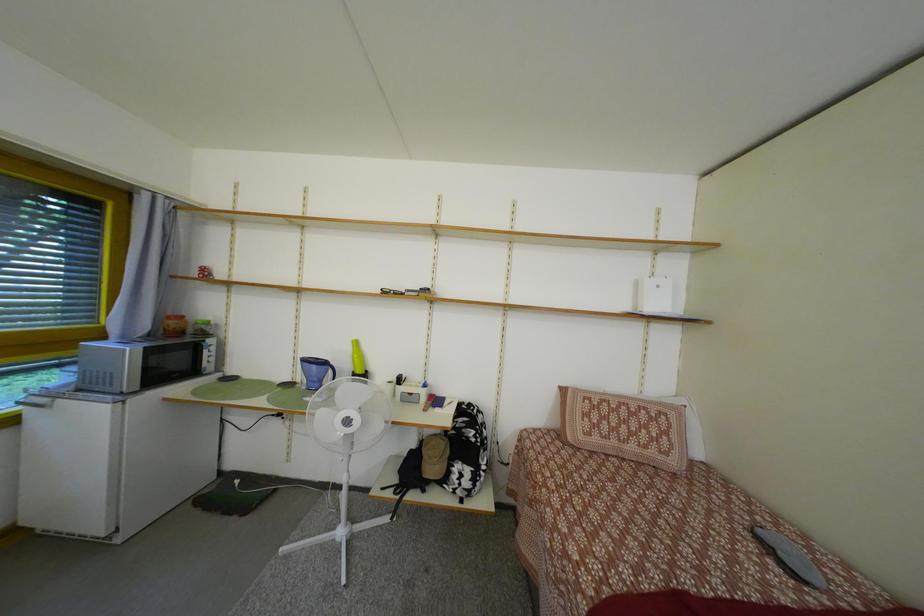
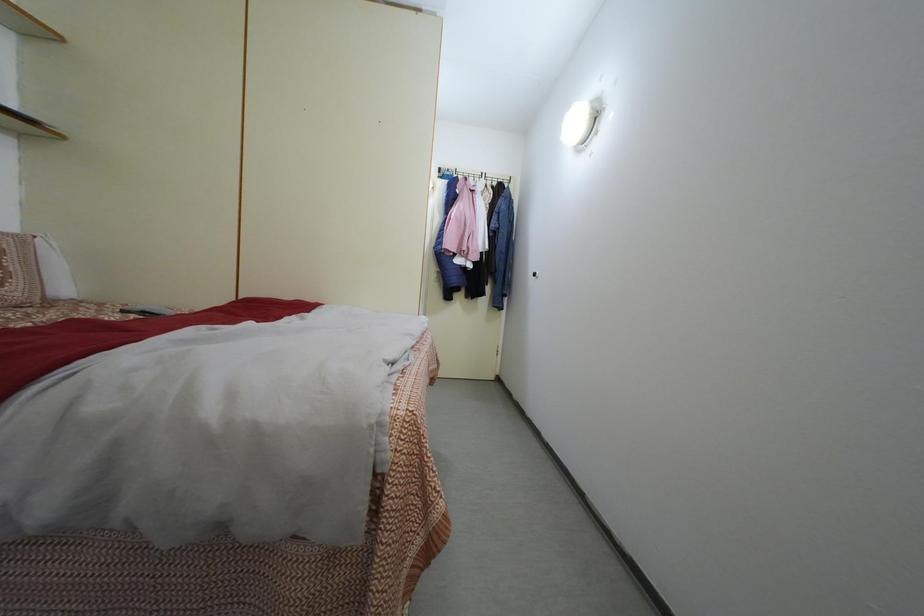
Question: The first image is from the beginning of the video and the second image is from the end. How did the camera likely rotate when shooting the video?

Choices:
 (A) Left
 (B) Right
 (C) Up
 (D) Down

Answer: (B)